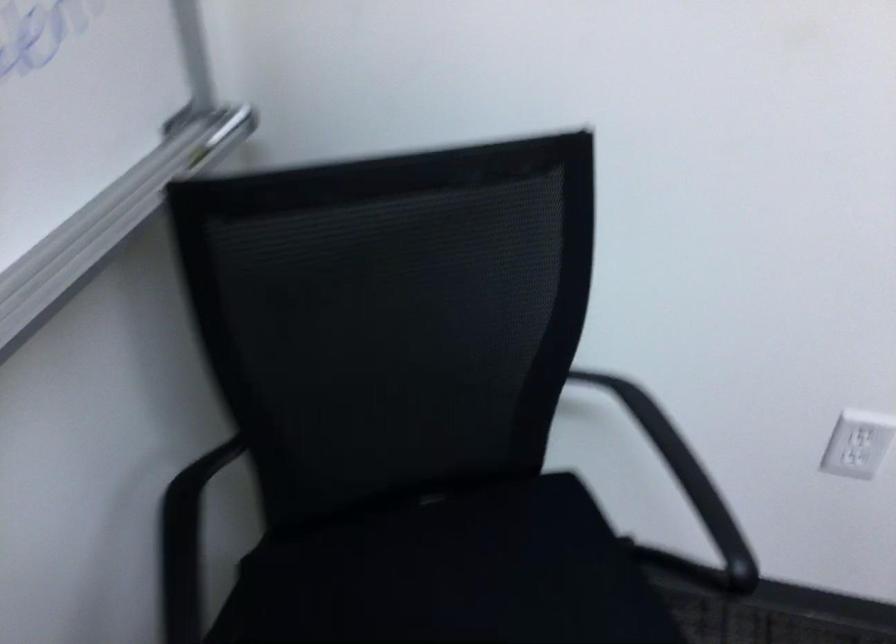
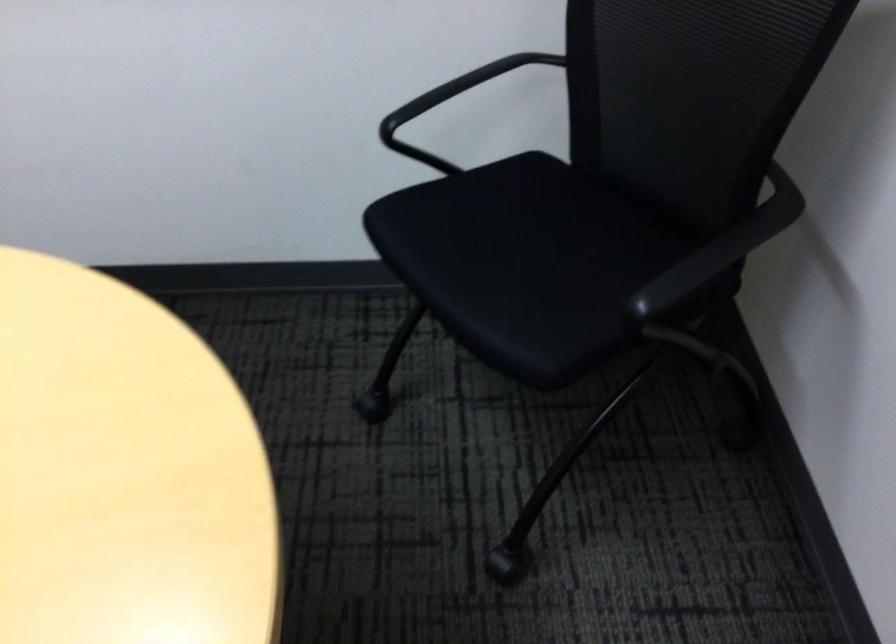
Find the pixel in the second image that matches (702,494) in the first image.

(702, 268)